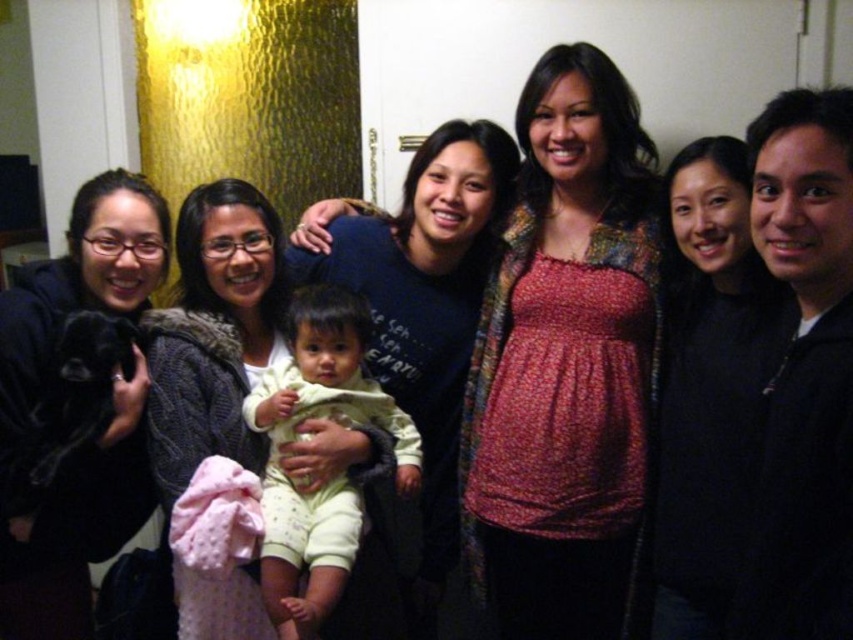
Question: Which of the following is the farthest from the observer?

Choices:
 (A) (606, 291)
 (B) (143, 196)

Answer: (B)

Question: From the image, what is the correct spatial relationship of floral-patterned blouse at center in relation to light yellow fabric at center?

Choices:
 (A) left
 (B) right

Answer: (B)

Question: Which point is closer to the camera?

Choices:
 (A) (323, 298)
 (B) (721, 141)
 (C) (477, 500)
 (D) (828, 426)

Answer: (D)

Question: Where is matte black shirt at center located in relation to light yellow fabric at center in the image?

Choices:
 (A) left
 (B) right

Answer: (B)

Question: Can you confirm if black fuzzy dog at left is smaller than matte black shirt at center?

Choices:
 (A) no
 (B) yes

Answer: (A)

Question: Estimate the real-world distances between objects in this image. Which object is closer to the matte black shirt at center?

Choices:
 (A) black fuzzy dog at left
 (B) black zip-up jacket at right
 (C) floral-patterned blouse at center
 (D) light yellow fabric at center

Answer: (C)